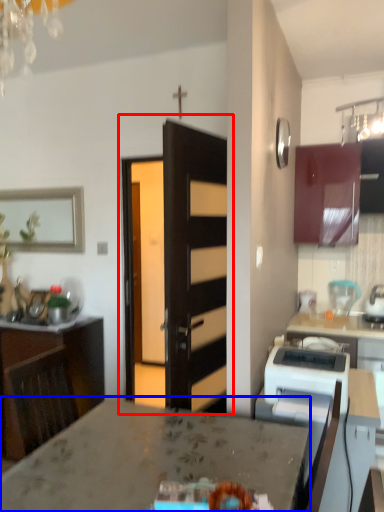
Question: Among these objects, which one is farthest to the camera, door (highlighted by a red box) or countertop (highlighted by a blue box)?

Choices:
 (A) door
 (B) countertop

Answer: (A)